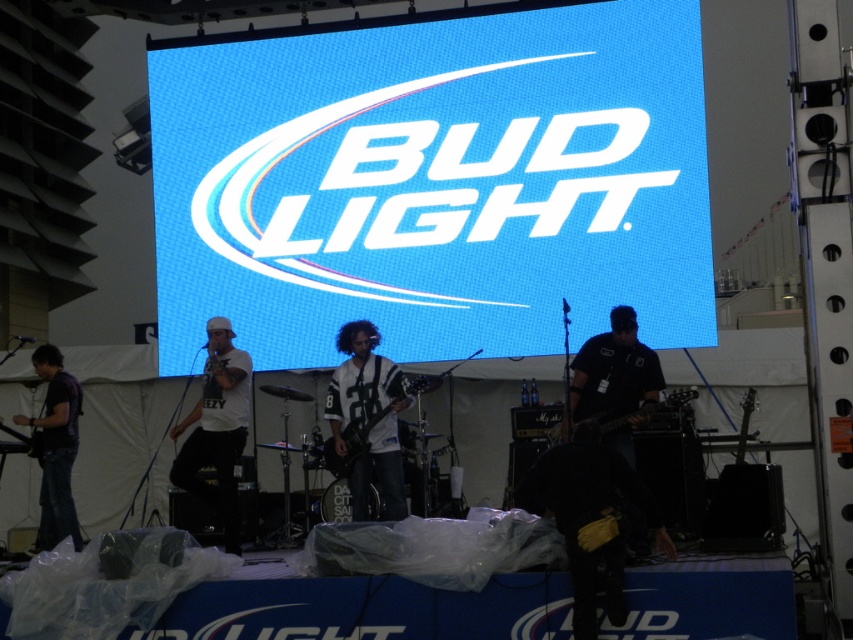
Question: Which object is the closest to the black matte shirt at right?

Choices:
 (A) dark purple shirt at left
 (B) white jersey at center
 (C) white matte shirt at center

Answer: (B)

Question: Which point is farther to the camera?

Choices:
 (A) (73, 384)
 (B) (218, 474)
 (C) (410, 388)

Answer: (A)

Question: Is black matte shirt at right to the left of black matte electric guitar at center from the viewer's perspective?

Choices:
 (A) yes
 (B) no

Answer: (B)

Question: Does black matte shirt at right have a lesser width compared to black matte electric guitar at center?

Choices:
 (A) yes
 (B) no

Answer: (B)

Question: Which of the following is the closest to the observer?

Choices:
 (A) black matte shirt at right
 (B) blue pixelated screen at center

Answer: (A)

Question: Can you confirm if white jersey at center is smaller than black matte electric guitar at center?

Choices:
 (A) yes
 (B) no

Answer: (B)